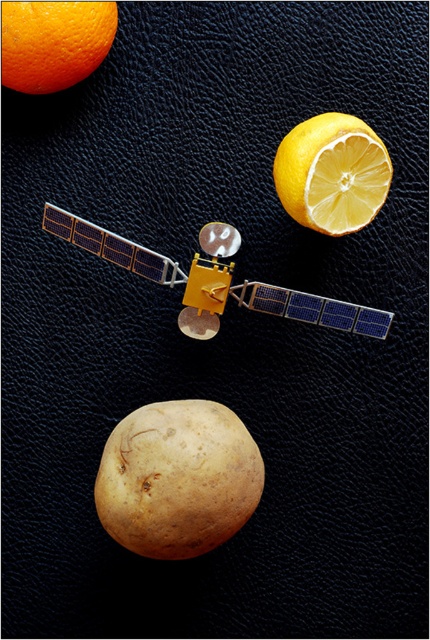
Question: Among these points, which one is farthest from the camera?

Choices:
 (A) (369, 166)
 (B) (184, 406)

Answer: (B)

Question: Does yellow matte/sliced lemon at upper right have a lesser width compared to orange matte at upper left?

Choices:
 (A) yes
 (B) no

Answer: (B)

Question: Is smooth brown potato at center to the right of orange matte at upper left from the viewer's perspective?

Choices:
 (A) no
 (B) yes

Answer: (B)

Question: Is yellow matte/sliced lemon at upper right below orange matte at upper left?

Choices:
 (A) no
 (B) yes

Answer: (B)

Question: Considering the real-world distances, which object is farthest from the orange matte at upper left?

Choices:
 (A) yellow matte/sliced lemon at upper right
 (B) smooth brown potato at center

Answer: (B)

Question: Among these points, which one is nearest to the camera?

Choices:
 (A) (321, 182)
 (B) (141, 474)

Answer: (B)